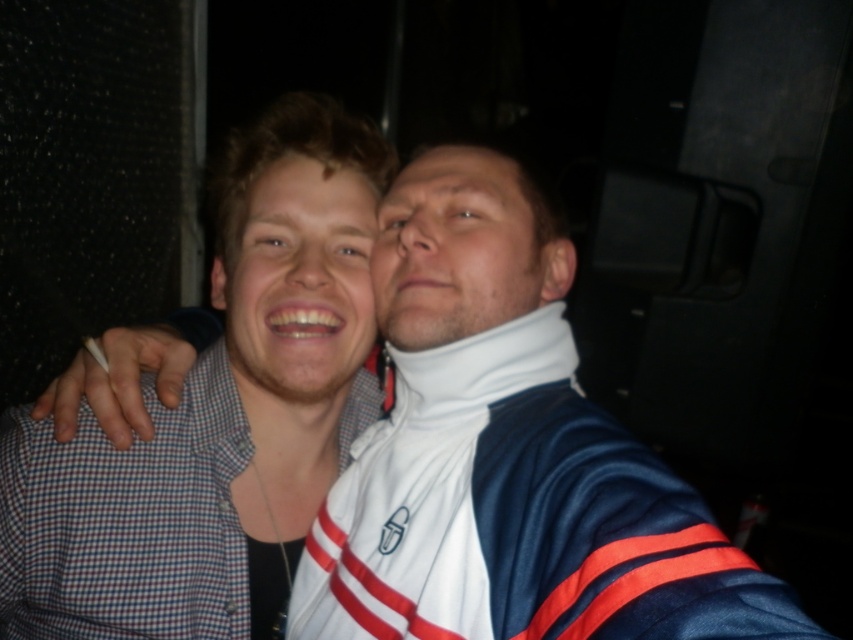
Is point (254, 564) in front of point (351, 356)?

Yes.

Is point (271, 612) positioned before point (256, 310)?

No, (271, 612) is behind (256, 310).

I want to click on checkered fabric shirt at left, so click(216, 413).

Is matte skin face at center further to camera compared to white matte neck brace at center?

Yes, it is.

Identify the location of matte skin face at center. (299, 282).

Locate an element on the screen. The width and height of the screenshot is (853, 640). matte skin face at center is located at coordinates (299, 282).

Is checkered fabric shirt at left thinner than white matte neck brace at center?

No, checkered fabric shirt at left is not thinner than white matte neck brace at center.

The height and width of the screenshot is (640, 853). What do you see at coordinates (216, 413) in the screenshot?
I see `checkered fabric shirt at left` at bounding box center [216, 413].

Locate an element on the screen. The height and width of the screenshot is (640, 853). checkered fabric shirt at left is located at coordinates (216, 413).